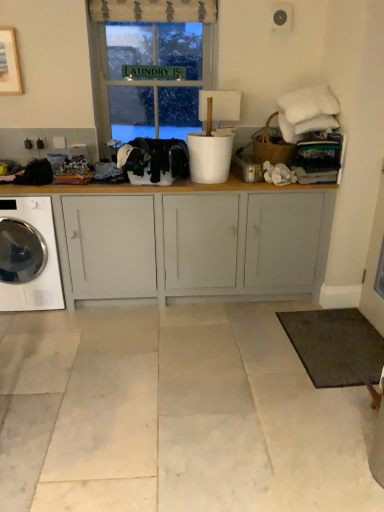
Question: Is dark gray carpet at lower right surrounding black fabric at center, the first clothing in the right-to-left sequence?

Choices:
 (A) yes
 (B) no

Answer: (B)

Question: From a real-world perspective, is dark gray carpet at lower right below black fabric at center, the first clothing in the right-to-left sequence?

Choices:
 (A) yes
 (B) no

Answer: (A)

Question: Is the depth of dark gray carpet at lower right less than that of black fabric at center, the first clothing in the right-to-left sequence?

Choices:
 (A) no
 (B) yes

Answer: (B)

Question: Considering the relative positions of dark gray carpet at lower right and black fabric at center, the second clothing from the left, in the image provided, is dark gray carpet at lower right to the right of black fabric at center, the second clothing from the left, from the viewer's perspective?

Choices:
 (A) yes
 (B) no

Answer: (A)

Question: Considering the relative sizes of dark gray carpet at lower right and black fabric at center, the second clothing from the left, in the image provided, is dark gray carpet at lower right wider than black fabric at center, the second clothing from the left,?

Choices:
 (A) yes
 (B) no

Answer: (A)

Question: Is dark gray carpet at lower right turned away from black fabric at center, the second clothing from the left?

Choices:
 (A) no
 (B) yes

Answer: (A)

Question: Is matte gray cabinet at center at the left side of dark gray carpet at lower right?

Choices:
 (A) no
 (B) yes

Answer: (B)

Question: Is dark gray carpet at lower right at the back of matte gray cabinet at center?

Choices:
 (A) no
 (B) yes

Answer: (A)

Question: Is matte gray cabinet at center to the right of dark gray carpet at lower right from the viewer's perspective?

Choices:
 (A) yes
 (B) no

Answer: (B)

Question: Considering the relative sizes of matte gray cabinet at center and dark gray carpet at lower right in the image provided, is matte gray cabinet at center smaller than dark gray carpet at lower right?

Choices:
 (A) no
 (B) yes

Answer: (A)

Question: Is dark gray carpet at lower right located within matte gray cabinet at center?

Choices:
 (A) yes
 (B) no

Answer: (B)

Question: From a real-world perspective, is matte gray cabinet at center on dark gray carpet at lower right?

Choices:
 (A) yes
 (B) no

Answer: (A)

Question: Is black fabric at center, the second clothing from the left, shorter than white glossy washing machine at lower left?

Choices:
 (A) yes
 (B) no

Answer: (A)